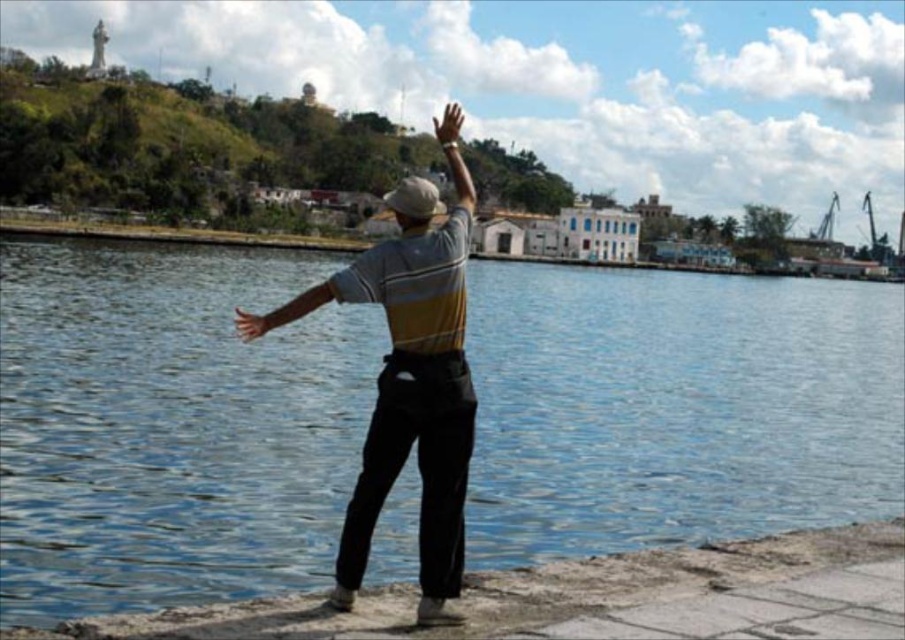
You are a photographer trying to capture the man in the striped polo shirt and the beige fabric baseball hat at center. According to the coordinates provided, where should you focus your camera to ensure both the man and his hat are clearly visible in the photo?

The beige fabric baseball hat at center is positioned at coordinates point (414, 198). To capture both the man and his hat clearly, focus your camera at that point since the hat is centrally located on the man.

You are standing at the point closer to the water in the riverside scene. There are two points marked in the image, one at coordinates point (x=408, y=180) and the other at point (x=260, y=317). Which point is farther away from you?

Point (x=408, y=180) is behind point (x=260, y=317), so if you are standing at the point closer to the water, which is point (x=260, y=317), then point (x=408, y=180) is farther away from you.